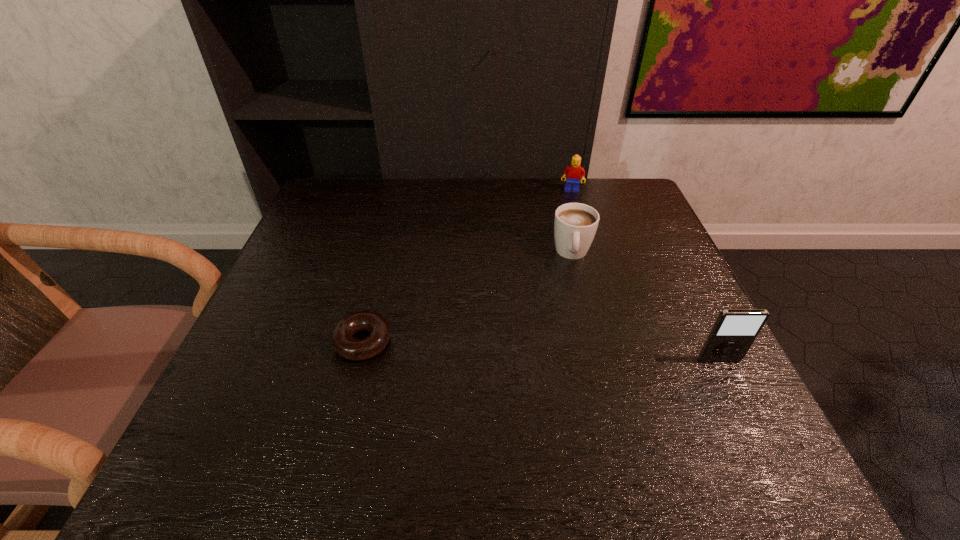
The height and width of the screenshot is (540, 960). Find the location of `free space located 0.150m with the handle on the side of the cappuccino`. free space located 0.150m with the handle on the side of the cappuccino is located at coordinates (573, 318).

Identify the location of blank area located 0.370m on the face of the farthest object. (560, 275).

Where is `free space located 0.260m on the face of the farthest object`? The height and width of the screenshot is (540, 960). free space located 0.260m on the face of the farthest object is located at coordinates (563, 246).

This screenshot has width=960, height=540. In order to click on free spot located on the face of the farthest object in this screenshot , I will do `click(567, 210)`.

The image size is (960, 540). What are the coordinates of `object present at the far edge` in the screenshot? It's located at (574, 172).

In order to click on iPod at the right edge in this screenshot , I will do coord(735,330).

At what (x,y) coordinates should I click in order to perform the action: click on Lego that is at the right edge. Please return your answer as a coordinate pair (x, y). Looking at the image, I should click on click(574, 172).

Find the location of a particular element. The height and width of the screenshot is (540, 960). object positioned at the far right corner is located at coordinates (574, 172).

At what (x,y) coordinates should I click in order to perform the action: click on blank space at the far edge of the desktop. Please return your answer as a coordinate pair (x, y). Looking at the image, I should click on (544, 210).

The height and width of the screenshot is (540, 960). Identify the location of free space at the near edge of the desktop. (654, 410).